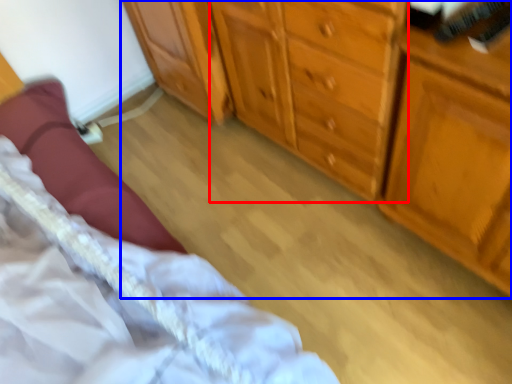
Question: Among these objects, which one is farthest to the camera, cabinetry (highlighted by a red box) or chest of drawers (highlighted by a blue box)?

Choices:
 (A) cabinetry
 (B) chest of drawers

Answer: (A)